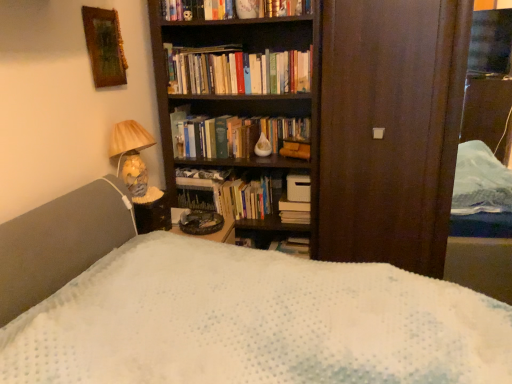
Where is `wooden picture frame at upper left`? wooden picture frame at upper left is located at coordinates (104, 46).

Measure the distance between hardcover book at center and camera.

hardcover book at center is 2.43 meters from camera.

At what (x,y) coordinates should I click in order to perform the action: click on hardcover books at upper center, the 2th book positioned from the back. Please return your answer as a coordinate pair (x, y). This screenshot has width=512, height=384. Looking at the image, I should click on (238, 72).

How much space does hardcover books at upper center, which is the first book in front-to-back order, occupy horizontally?

The width of hardcover books at upper center, which is the first book in front-to-back order, is 3.15 inches.

I want to click on matte ceramic lamp at left, so click(x=131, y=154).

Would you say matte ceramic lamp at left is outside wooden picture frame at upper left?

That's correct, matte ceramic lamp at left is outside of wooden picture frame at upper left.

Between matte ceramic lamp at left and wooden picture frame at upper left, which one has smaller width?

Thinner between the two is wooden picture frame at upper left.

Considering the sizes of objects matte ceramic lamp at left and wooden picture frame at upper left in the image provided, who is bigger, matte ceramic lamp at left or wooden picture frame at upper left?

matte ceramic lamp at left.

Consider the image. Is hardcover book at center, placed as the first book when sorted from back to front, taller or shorter than wooden picture frame at upper left?

Considering their sizes, hardcover book at center, placed as the first book when sorted from back to front, has less height than wooden picture frame at upper left.

Identify the location of the 2nd book directly beneath the wooden picture frame at upper left (from a real-world perspective). This screenshot has height=384, width=512. (244, 198).

Considering the relative sizes of hardcover book at center, which is counted as the 1th book, starting from the bottom, and wooden picture frame at upper left in the image provided, is hardcover book at center, which is counted as the 1th book, starting from the bottom, bigger than wooden picture frame at upper left?

Correct, hardcover book at center, which is counted as the 1th book, starting from the bottom, is larger in size than wooden picture frame at upper left.

How far apart are hardcover book at center, which is counted as the 1th book, starting from the bottom, and wooden picture frame at upper left?

The distance of hardcover book at center, which is counted as the 1th book, starting from the bottom, from wooden picture frame at upper left is 37.80 inches.

Which of these two, hardcover book at center, positioned as the second book in front-to-back order, or hardcover books at upper center, marked as the second book in a bottom-to-top arrangement, is wider?

Wider between the two is hardcover book at center, positioned as the second book in front-to-back order.

From a real-world perspective, is hardcover book at center, placed as the first book when sorted from back to front, physically located above or below hardcover books at upper center, which is counted as the first book, starting from the top?

hardcover book at center, placed as the first book when sorted from back to front, is situated lower than hardcover books at upper center, which is counted as the first book, starting from the top, in the real world.

From the image's perspective, which is below, hardcover book at center, the second book positioned from the top, or hardcover books at upper center, marked as the second book in a bottom-to-top arrangement?

hardcover book at center, the second book positioned from the top, is shown below in the image.

Is hardcover book at center, positioned as the second book in front-to-back order, outside of hardcover books at upper center, marked as the second book in a bottom-to-top arrangement?

hardcover book at center, positioned as the second book in front-to-back order, is positioned outside hardcover books at upper center, marked as the second book in a bottom-to-top arrangement.

Would you consider wooden picture frame at upper left to be distant from matte ceramic lamp at left?

No, wooden picture frame at upper left is in close proximity to matte ceramic lamp at left.

Between wooden picture frame at upper left and matte ceramic lamp at left, which one appears on the right side from the viewer's perspective?

matte ceramic lamp at left.

Is wooden picture frame at upper left positioned beyond the bounds of matte ceramic lamp at left?

Yes, wooden picture frame at upper left is not within matte ceramic lamp at left.

From a real-world perspective, is wooden picture frame at upper left located higher than matte ceramic lamp at left?

Yes, from a real-world perspective, wooden picture frame at upper left is over matte ceramic lamp at left

Who is smaller, hardcover books at upper center, which is counted as the first book, starting from the top, or hardcover book at center, placed as the first book when sorted from back to front?

With smaller size is hardcover book at center, placed as the first book when sorted from back to front.

Find the location of `book in front of the hardcover book at center, placed as the first book when sorted from back to front`. book in front of the hardcover book at center, placed as the first book when sorted from back to front is located at coordinates (238, 72).

Which of these two, hardcover books at upper center, marked as the second book in a bottom-to-top arrangement, or hardcover book at center, the second book positioned from the top, stands shorter?

With less height is hardcover book at center, the second book positioned from the top.

Is hardcover books at upper center, marked as the second book in a bottom-to-top arrangement, positioned far away from hardcover book at center, positioned as the second book in front-to-back order?

No, hardcover books at upper center, marked as the second book in a bottom-to-top arrangement, is not far from hardcover book at center, positioned as the second book in front-to-back order.

Is point (110, 14) closer to camera compared to point (220, 87)?

Yes, point (110, 14) is in front of point (220, 87).

Considering the relative sizes of wooden picture frame at upper left and hardcover books at upper center, the 2th book positioned from the back, in the image provided, is wooden picture frame at upper left taller than hardcover books at upper center, the 2th book positioned from the back,?

Indeed, wooden picture frame at upper left has a greater height compared to hardcover books at upper center, the 2th book positioned from the back.

Does wooden picture frame at upper left have a greater width compared to hardcover books at upper center, marked as the second book in a bottom-to-top arrangement?

In fact, wooden picture frame at upper left might be narrower than hardcover books at upper center, marked as the second book in a bottom-to-top arrangement.

Does wooden picture frame at upper left have a smaller size compared to hardcover books at upper center, which is counted as the first book, starting from the top?

Yes, wooden picture frame at upper left is smaller than hardcover books at upper center, which is counted as the first book, starting from the top.

Considering the sizes of objects hardcover book at center and matte ceramic lamp at left in the image provided, who is smaller, hardcover book at center or matte ceramic lamp at left?

hardcover book at center is smaller.

Considering the relative positions of hardcover book at center and matte ceramic lamp at left in the image provided, is hardcover book at center to the left or to the right of matte ceramic lamp at left?

Based on their positions, hardcover book at center is located to the right of matte ceramic lamp at left.

Is point (170, 133) in front of point (124, 135)?

No, (170, 133) is further to viewer.

Which object is further away from the camera taking this photo, hardcover book at center or matte ceramic lamp at left?

hardcover book at center is further from the camera.

Locate an element on the screen. picture frame on the left of matte ceramic lamp at left is located at coordinates (104, 46).

Starting from the wooden picture frame at upper left, which book is the 1st one to the right? Please provide its 2D coordinates.

[(244, 198)]

From the image, which object appears to be nearer to hardcover books at upper center, which is counted as the first book, starting from the top, hardcover book at center or matte ceramic lamp at left?

hardcover book at center is closer to hardcover books at upper center, which is counted as the first book, starting from the top.

Looking at the image, which one is located further to hardcover books at upper center, marked as the second book in a bottom-to-top arrangement, wooden picture frame at upper left or matte ceramic lamp at left?

The object further to hardcover books at upper center, marked as the second book in a bottom-to-top arrangement, is matte ceramic lamp at left.

Based on their spatial positions, is hardcover books at upper center, the 2th book positioned from the back, or hardcover book at center, placed as the first book when sorted from back to front, further from matte ceramic lamp at left?

hardcover book at center, placed as the first book when sorted from back to front, is further to matte ceramic lamp at left.

From the image, which object appears to be farther from wooden picture frame at upper left, hardcover books at upper center, the 2th book positioned from the back, or hardcover book at center, which is counted as the 1th book, starting from the bottom?

hardcover book at center, which is counted as the 1th book, starting from the bottom.

Which object lies nearer to the anchor point hardcover book at center, hardcover books at upper center, which is the first book in front-to-back order, or wooden picture frame at upper left?

hardcover books at upper center, which is the first book in front-to-back order, lies closer to hardcover book at center than the other object.

From the image, which object appears to be nearer to hardcover book at center, the second book positioned from the top, matte ceramic lamp at left or hardcover books at upper center, which is the first book in front-to-back order?

hardcover books at upper center, which is the first book in front-to-back order, lies closer to hardcover book at center, the second book positioned from the top, than the other object.

Estimate the real-world distances between objects in this image. Which object is further from matte ceramic lamp at left, hardcover books at upper center, which is counted as the first book, starting from the top, or wooden picture frame at upper left?

hardcover books at upper center, which is counted as the first book, starting from the top, lies further to matte ceramic lamp at left than the other object.

When comparing their distances from hardcover book at center, positioned as the second book in front-to-back order, does hardcover books at upper center, marked as the second book in a bottom-to-top arrangement, or hardcover book at center seem closer?

Among the two, hardcover book at center is located nearer to hardcover book at center, positioned as the second book in front-to-back order.

This screenshot has width=512, height=384. In order to click on paperback book between matte ceramic lamp at left and hardcover book at center, the second book positioned from the top, from front to back in this screenshot , I will do `click(177, 125)`.

Find the location of a particular element. table lamp between hardcover books at upper center, which is counted as the first book, starting from the top, and hardcover book at center, the second book positioned from the top, in the up-down direction is located at coordinates (131, 154).

You are a GUI agent. You are given a task and a screenshot of the screen. Output one action in this format:
    pyautogui.click(x=<x>, y=<y>)
    Task: Click on the table lamp between wooden picture frame at upper left and hardcover book at center along the z-axis
    
    Given the screenshot: What is the action you would take?
    pyautogui.click(x=131, y=154)

At what (x,y) coordinates should I click in order to perform the action: click on table lamp situated between wooden picture frame at upper left and hardcover books at upper center, marked as the second book in a bottom-to-top arrangement, from left to right. Please return your answer as a coordinate pair (x, y). This screenshot has height=384, width=512. Looking at the image, I should click on (131, 154).